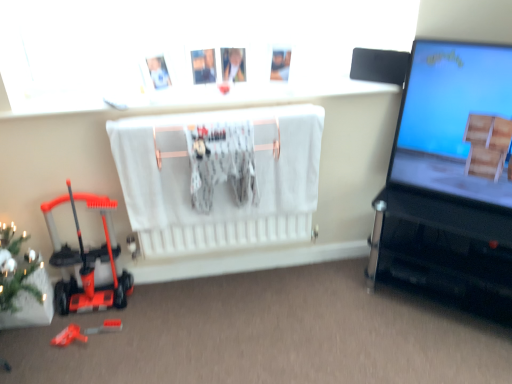
Question: Is orange plastic toy at lower left, positioned as the 3th toy in bottom-to-top order, oriented towards rubberized orange toy at lower left, which is counted as the 2th toy, starting from the top?

Choices:
 (A) no
 (B) yes

Answer: (B)

Question: Can you confirm if orange plastic toy at lower left, positioned as the 3th toy in bottom-to-top order, is bigger than rubberized orange toy at lower left, which is counted as the 2th toy, starting from the top?

Choices:
 (A) no
 (B) yes

Answer: (B)

Question: Can you see orange plastic toy at lower left, the 1th toy when ordered from top to bottom, touching rubberized orange toy at lower left, which is counted as the 2th toy, starting from the top?

Choices:
 (A) yes
 (B) no

Answer: (B)

Question: Is orange plastic toy at lower left, positioned as the 3th toy in bottom-to-top order, positioned before rubberized orange toy at lower left, which is counted as the second toy, starting from the bottom?

Choices:
 (A) no
 (B) yes

Answer: (B)

Question: From a real-world perspective, does orange plastic toy at lower left, the 1th toy when ordered from top to bottom, sit lower than rubberized orange toy at lower left, which is counted as the 2th toy, starting from the top?

Choices:
 (A) no
 (B) yes

Answer: (A)

Question: From a real-world perspective, is green matte christmas tree at lower left positioned above or below rubberized orange toy at lower left, which is counted as the second toy, starting from the bottom?

Choices:
 (A) below
 (B) above

Answer: (B)

Question: Is green matte christmas tree at lower left bigger or smaller than rubberized orange toy at lower left, which is counted as the second toy, starting from the bottom?

Choices:
 (A) small
 (B) big

Answer: (B)

Question: In the image, is green matte christmas tree at lower left positioned in front of or behind rubberized orange toy at lower left, which is counted as the 2th toy, starting from the top?

Choices:
 (A) behind
 (B) front

Answer: (B)

Question: Considering the relative positions of green matte christmas tree at lower left and rubberized orange toy at lower left, which is counted as the 2th toy, starting from the top, in the image provided, is green matte christmas tree at lower left to the left or to the right of rubberized orange toy at lower left, which is counted as the 2th toy, starting from the top,?

Choices:
 (A) left
 (B) right

Answer: (A)

Question: Based on their sizes in the image, would you say black glossy tv stand at right is bigger or smaller than orange plastic toy at lower left, the 1th toy when ordered from top to bottom?

Choices:
 (A) small
 (B) big

Answer: (B)

Question: In terms of width, does black glossy tv stand at right look wider or thinner when compared to orange plastic toy at lower left, the 1th toy when ordered from top to bottom?

Choices:
 (A) wide
 (B) thin

Answer: (A)

Question: Is black glossy tv stand at right taller or shorter than orange plastic toy at lower left, positioned as the 3th toy in bottom-to-top order?

Choices:
 (A) short
 (B) tall

Answer: (A)

Question: Is point (380, 240) closer or farther from the camera than point (110, 208)?

Choices:
 (A) closer
 (B) farther

Answer: (B)

Question: From the image's perspective, relative to rubberized orange toy at lower left, arranged as the 3th toy when viewed from the top, is matte blue screen at right above or below?

Choices:
 (A) above
 (B) below

Answer: (A)

Question: In terms of height, does matte blue screen at right look taller or shorter compared to rubberized orange toy at lower left, the first toy from the bottom?

Choices:
 (A) tall
 (B) short

Answer: (A)